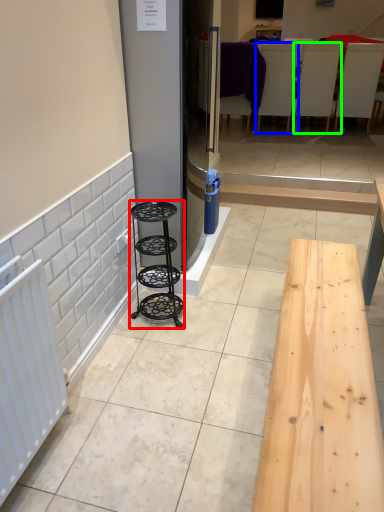
Question: Considering the real-world distances, which object is farthest from furniture (highlighted by a red box)? furniture (highlighted by a blue box) or furniture (highlighted by a green box)?

Choices:
 (A) furniture
 (B) furniture

Answer: (B)